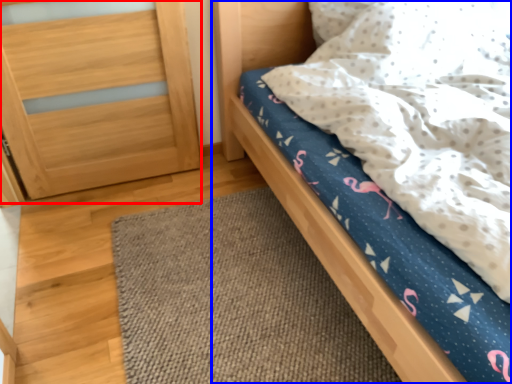
Question: Which of the following is the farthest to the observer, balustrade (highlighted by a red box) or bed (highlighted by a blue box)?

Choices:
 (A) balustrade
 (B) bed

Answer: (A)